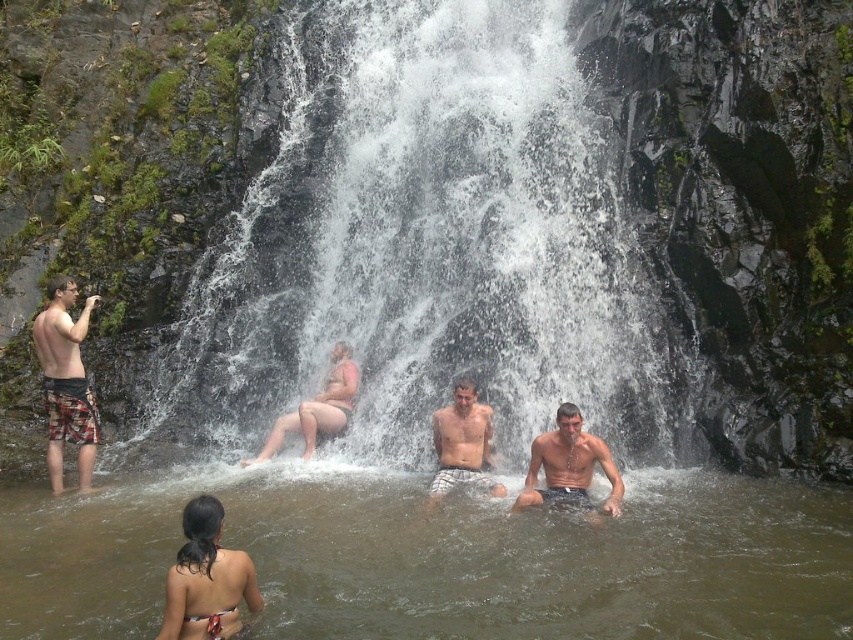
Question: Which object is closer to the camera taking this photo?

Choices:
 (A) smooth tan skin at center
 (B) white frothy water at center
 (C) plaid shorts at left
 (D) shiny wet skin at center

Answer: (D)

Question: From the image, what is the correct spatial relationship of white frothy water at center in relation to brown murky water at center?

Choices:
 (A) below
 (B) above

Answer: (B)

Question: Does plaid shorts at left lie behind shiny wet skin at center?

Choices:
 (A) no
 (B) yes

Answer: (B)

Question: Can you confirm if white frothy water at center is wider than plaid shorts at left?

Choices:
 (A) no
 (B) yes

Answer: (B)

Question: Which of these objects is positioned farthest from the smooth tan skin at center?

Choices:
 (A) plaid shorts at left
 (B) shiny wet skin at center

Answer: (B)

Question: Which point is farther from the camera taking this photo?

Choices:
 (A) (175, 348)
 (B) (216, 616)
 (C) (61, 442)

Answer: (A)